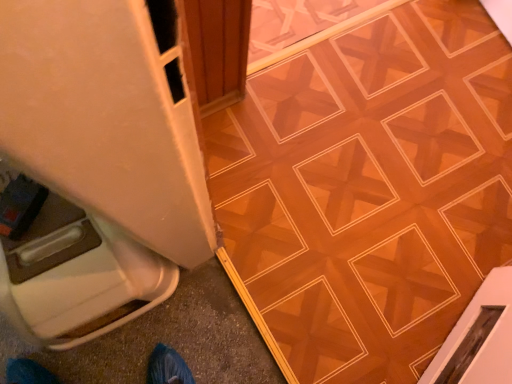
Question: Considering the relative sizes of wooden parquet floor at center and white plastic container at lower left in the image provided, is wooden parquet floor at center smaller than white plastic container at lower left?

Choices:
 (A) no
 (B) yes

Answer: (B)

Question: Can you confirm if wooden parquet floor at center is thinner than white plastic container at lower left?

Choices:
 (A) yes
 (B) no

Answer: (B)

Question: Considering the relative sizes of wooden parquet floor at center and white plastic container at lower left in the image provided, is wooden parquet floor at center taller than white plastic container at lower left?

Choices:
 (A) no
 (B) yes

Answer: (A)

Question: Would you say wooden parquet floor at center contains white plastic container at lower left?

Choices:
 (A) no
 (B) yes

Answer: (A)

Question: Does wooden parquet floor at center touch white plastic container at lower left?

Choices:
 (A) no
 (B) yes

Answer: (A)

Question: Is wooden parquet floor at center to the right of white plastic container at lower left from the viewer's perspective?

Choices:
 (A) no
 (B) yes

Answer: (B)

Question: Is white plastic container at lower left further to the viewer compared to wooden parquet floor at center?

Choices:
 (A) yes
 (B) no

Answer: (B)

Question: Can you confirm if white plastic container at lower left is bigger than wooden parquet floor at center?

Choices:
 (A) no
 (B) yes

Answer: (B)

Question: Could you tell me if white plastic container at lower left is facing wooden parquet floor at center?

Choices:
 (A) yes
 (B) no

Answer: (B)

Question: Is wooden parquet floor at center inside white plastic container at lower left?

Choices:
 (A) no
 (B) yes

Answer: (A)

Question: From a real-world perspective, is white plastic container at lower left under wooden parquet floor at center?

Choices:
 (A) no
 (B) yes

Answer: (A)

Question: Can you see white plastic container at lower left touching wooden parquet floor at center?

Choices:
 (A) no
 (B) yes

Answer: (A)

Question: From their relative heights in the image, would you say wooden parquet floor at center is taller or shorter than white plastic container at lower left?

Choices:
 (A) short
 (B) tall

Answer: (A)